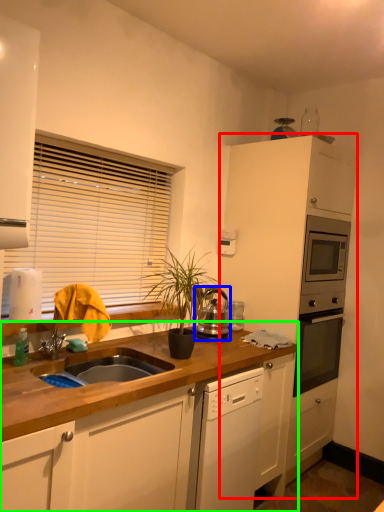
Question: Which object is the farthest from cabinetry (highlighted by a red box)? Choose among these: kitchen appliance (highlighted by a blue box) or countertop (highlighted by a green box).

Choices:
 (A) kitchen appliance
 (B) countertop

Answer: (B)